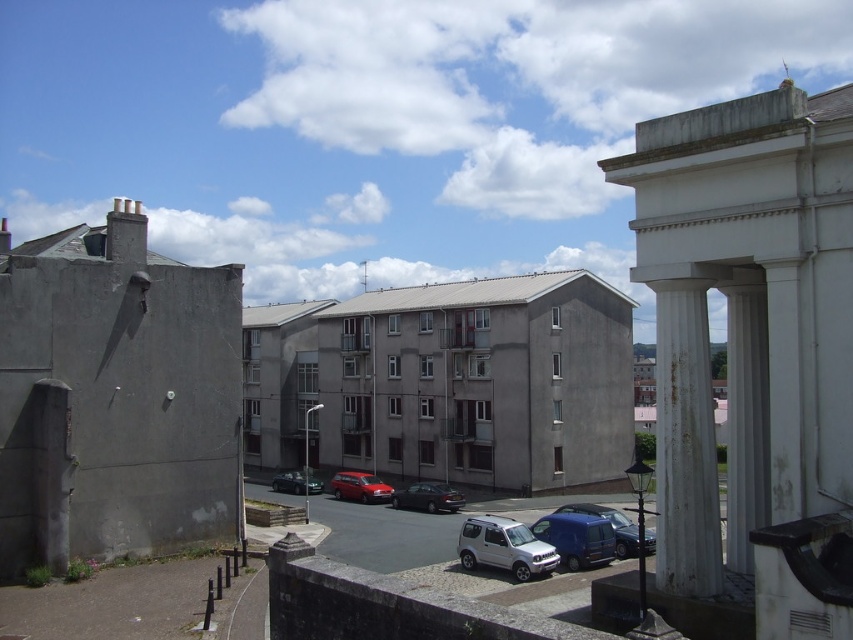
Question: Which point is farther to the camera?

Choices:
 (A) (515, 552)
 (B) (677, 305)
 (C) (572, 509)
 (D) (354, 481)

Answer: (D)

Question: Which point is closer to the camera taking this photo?

Choices:
 (A) (485, 529)
 (B) (387, 496)
 (C) (616, 548)
 (D) (698, 435)

Answer: (D)

Question: Which point appears farthest from the camera in this image?

Choices:
 (A) (643, 540)
 (B) (363, 481)
 (C) (444, 499)

Answer: (B)

Question: Can you confirm if shiny black sedan at center is positioned to the left of metallic silver sedan at center?

Choices:
 (A) no
 (B) yes

Answer: (A)

Question: Is silver metallic suv at center further to camera compared to shiny black sedan at center?

Choices:
 (A) no
 (B) yes

Answer: (A)

Question: Can you confirm if matte blue van at lower center is bigger than shiny black sedan at center?

Choices:
 (A) yes
 (B) no

Answer: (B)